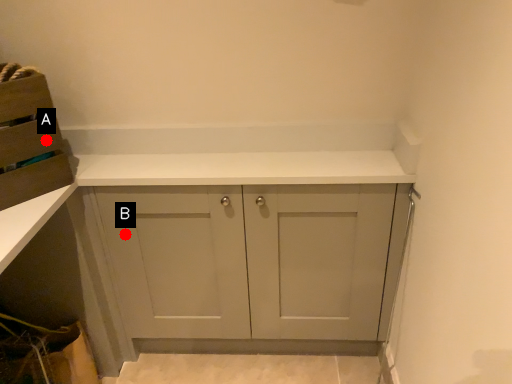
Question: Two points are circled on the image, labeled by A and B beside each circle. Which point is closer to the camera taking this photo?

Choices:
 (A) A is closer
 (B) B is closer

Answer: (A)